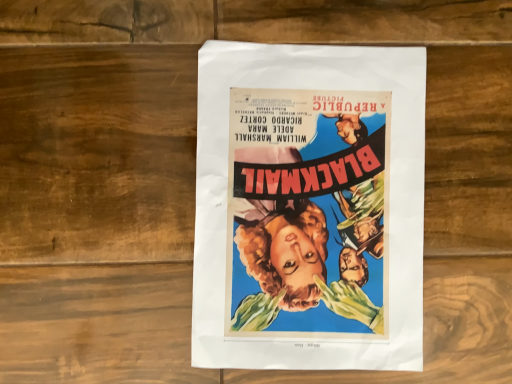
Locate an element on the screen. The height and width of the screenshot is (384, 512). vacant region above vibrant paper poster at center (from a real-world perspective) is located at coordinates (316, 198).